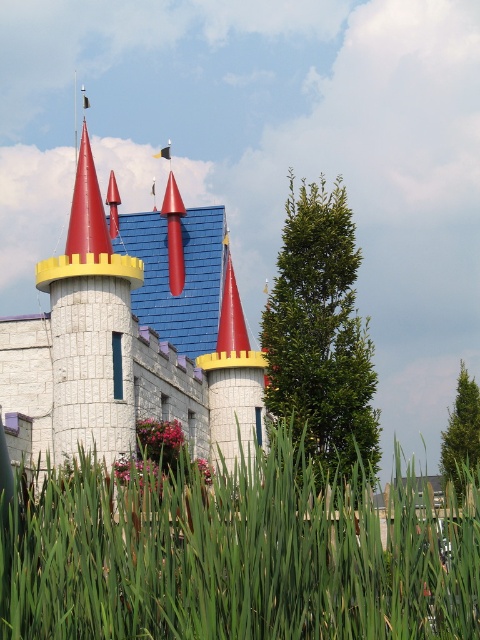
Question: Can you confirm if green grass at lower center is positioned above white plastic castle at center?

Choices:
 (A) no
 (B) yes

Answer: (A)

Question: Does green grass at lower center appear on the left side of white plastic castle at center?

Choices:
 (A) no
 (B) yes

Answer: (A)

Question: Which point is farther to the camera?

Choices:
 (A) green grass at lower center
 (B) white plastic castle at center

Answer: (B)

Question: Does green grass at lower center have a smaller size compared to white plastic castle at center?

Choices:
 (A) yes
 (B) no

Answer: (A)

Question: Which of the following is the closest to the observer?

Choices:
 (A) green grass at lower center
 (B) white plastic castle at center

Answer: (A)